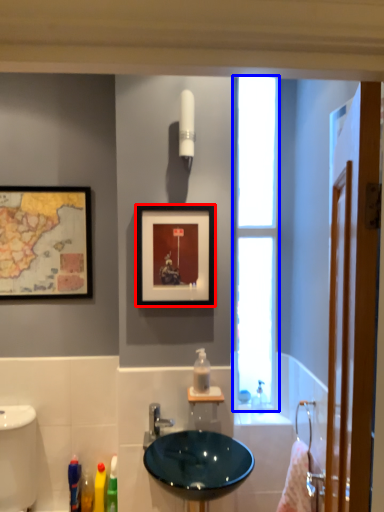
Question: Which object is closer to the camera taking this photo, picture frame (highlighted by a red box) or window (highlighted by a blue box)?

Choices:
 (A) picture frame
 (B) window

Answer: (A)